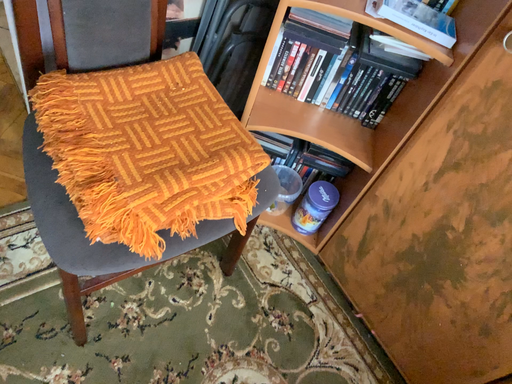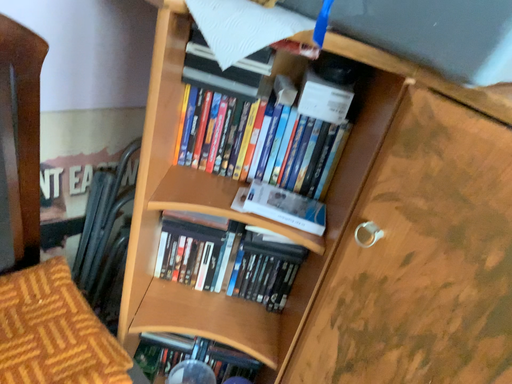
Question: How did the camera likely rotate when shooting the video?

Choices:
 (A) rotated downward
 (B) rotated upward

Answer: (B)